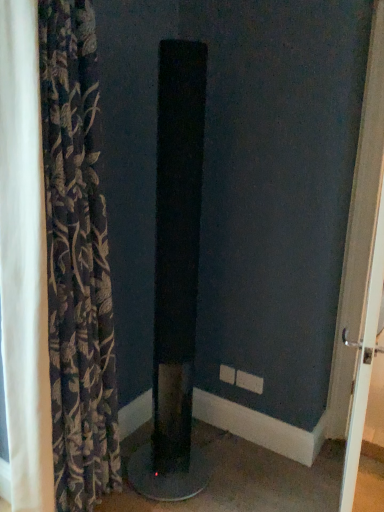
Question: Considering the relative sizes of white glossy door handle at right and dark floral fabric curtain at left in the image provided, is white glossy door handle at right shorter than dark floral fabric curtain at left?

Choices:
 (A) yes
 (B) no

Answer: (A)

Question: Could you tell me if white glossy door handle at right is turned towards dark floral fabric curtain at left?

Choices:
 (A) yes
 (B) no

Answer: (B)

Question: Considering the relative sizes of white glossy door handle at right and dark floral fabric curtain at left in the image provided, is white glossy door handle at right wider than dark floral fabric curtain at left?

Choices:
 (A) yes
 (B) no

Answer: (B)

Question: Is white glossy door handle at right far away from dark floral fabric curtain at left?

Choices:
 (A) no
 (B) yes

Answer: (B)

Question: From the image's perspective, does white glossy door handle at right appear lower than dark floral fabric curtain at left?

Choices:
 (A) yes
 (B) no

Answer: (A)

Question: Do you think dark floral fabric curtain at left is within white glossy door handle at right, or outside of it?

Choices:
 (A) inside
 (B) outside

Answer: (B)

Question: In the image, is dark floral fabric curtain at left positioned in front of or behind white glossy door handle at right?

Choices:
 (A) front
 (B) behind

Answer: (A)

Question: From their relative heights in the image, would you say dark floral fabric curtain at left is taller or shorter than white glossy door handle at right?

Choices:
 (A) tall
 (B) short

Answer: (A)

Question: Looking at their shapes, would you say dark floral fabric curtain at left is wider or thinner than white glossy door handle at right?

Choices:
 (A) wide
 (B) thin

Answer: (A)

Question: Visually, is dark floral fabric curtain at left positioned to the left or to the right of black matte speaker at center?

Choices:
 (A) left
 (B) right

Answer: (A)

Question: Is dark floral fabric curtain at left taller or shorter than black matte speaker at center?

Choices:
 (A) short
 (B) tall

Answer: (B)

Question: From the image's perspective, is dark floral fabric curtain at left above or below black matte speaker at center?

Choices:
 (A) below
 (B) above

Answer: (B)

Question: Is dark floral fabric curtain at left bigger or smaller than black matte speaker at center?

Choices:
 (A) small
 (B) big

Answer: (B)

Question: Considering the relative positions of black matte speaker at center and dark floral fabric curtain at left in the image provided, is black matte speaker at center to the left or to the right of dark floral fabric curtain at left?

Choices:
 (A) left
 (B) right

Answer: (B)

Question: Is black matte speaker at center spatially inside dark floral fabric curtain at left, or outside of it?

Choices:
 (A) inside
 (B) outside

Answer: (B)